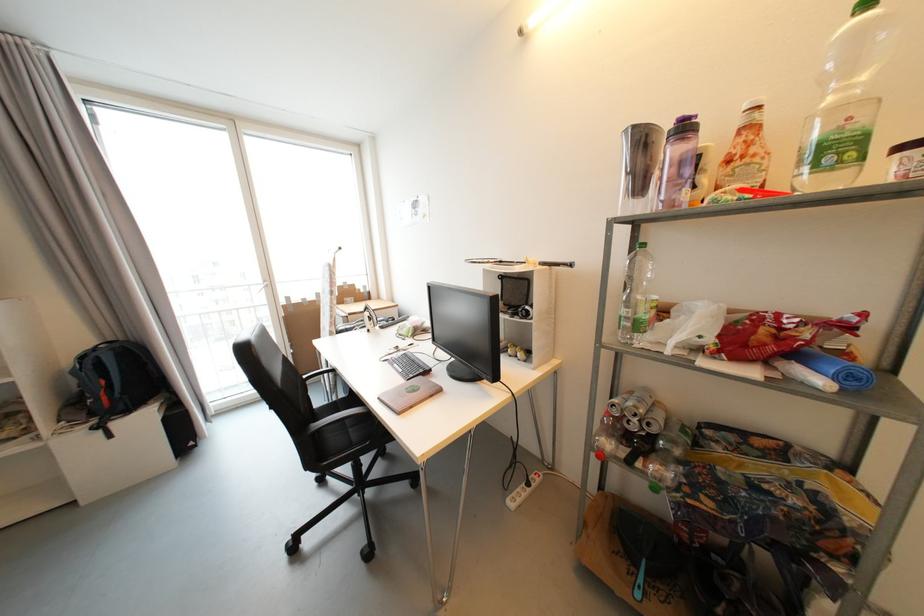
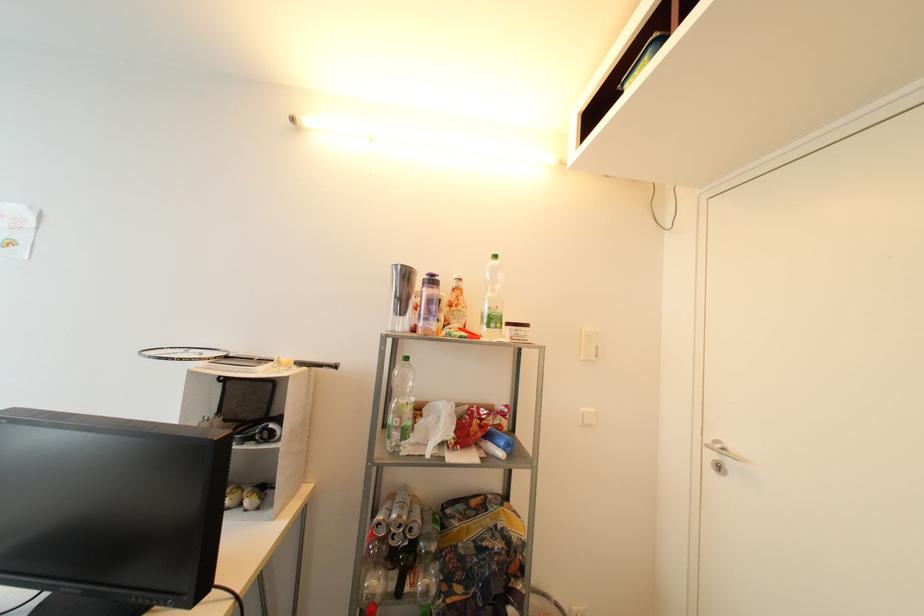
The point at (505, 264) is marked in the first image. Where is the corresponding point in the second image?

(232, 359)